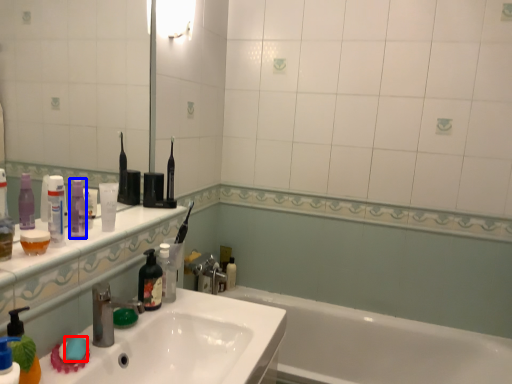
Question: Which object appears closest to the camera in this image, soap (highlighted by a red box) or toiletry (highlighted by a blue box)?

Choices:
 (A) soap
 (B) toiletry

Answer: (A)